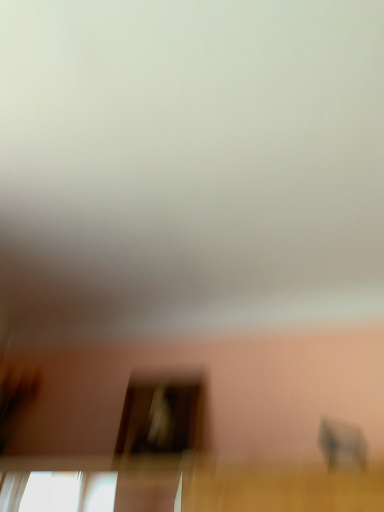
Question: Does gray matte baby elephant at lower right have a smaller size compared to transparent glass screen door at center?

Choices:
 (A) yes
 (B) no

Answer: (A)

Question: Is gray matte baby elephant at lower right positioned behind transparent glass screen door at center?

Choices:
 (A) no
 (B) yes

Answer: (A)

Question: From a real-world perspective, is gray matte baby elephant at lower right on top of transparent glass screen door at center?

Choices:
 (A) no
 (B) yes

Answer: (A)

Question: Is gray matte baby elephant at lower right wider than transparent glass screen door at center?

Choices:
 (A) no
 (B) yes

Answer: (A)

Question: Is gray matte baby elephant at lower right shorter than transparent glass screen door at center?

Choices:
 (A) yes
 (B) no

Answer: (A)

Question: Is gray matte baby elephant at lower right to the right of transparent glass screen door at center from the viewer's perspective?

Choices:
 (A) no
 (B) yes

Answer: (B)

Question: Is gray matte baby elephant at lower right completely or partially inside transparent glass screen door at center?

Choices:
 (A) no
 (B) yes

Answer: (A)

Question: Can you confirm if transparent glass screen door at center is wider than gray matte baby elephant at lower right?

Choices:
 (A) yes
 (B) no

Answer: (A)

Question: Does transparent glass screen door at center appear on the left side of gray matte baby elephant at lower right?

Choices:
 (A) yes
 (B) no

Answer: (A)

Question: From the image's perspective, is transparent glass screen door at center on gray matte baby elephant at lower right?

Choices:
 (A) no
 (B) yes

Answer: (A)

Question: Is transparent glass screen door at center facing away from gray matte baby elephant at lower right?

Choices:
 (A) yes
 (B) no

Answer: (B)

Question: Could you tell me if transparent glass screen door at center is turned towards gray matte baby elephant at lower right?

Choices:
 (A) yes
 (B) no

Answer: (B)

Question: From their relative heights in the image, would you say gray matte baby elephant at lower right is taller or shorter than transparent glass screen door at center?

Choices:
 (A) tall
 (B) short

Answer: (B)